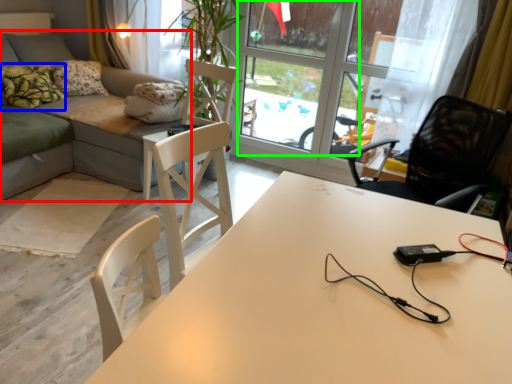
Question: Which is farther away from studio couch (highlighted by a red box)? pillow (highlighted by a blue box) or window screen (highlighted by a green box)?

Choices:
 (A) pillow
 (B) window screen

Answer: (B)